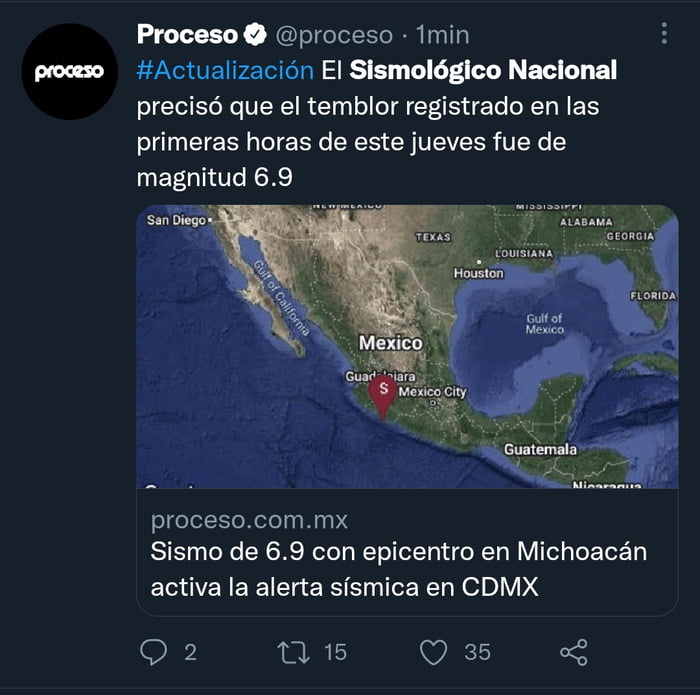
Identify the location of map. The image size is (700, 695). (362, 277).